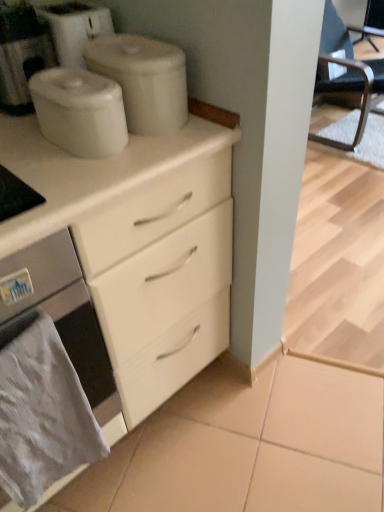
Question: In the image, is black leather chair at right on the left side or the right side of white matte coffee machine at upper left?

Choices:
 (A) left
 (B) right

Answer: (B)

Question: Is point (327, 30) closer or farther from the camera than point (16, 109)?

Choices:
 (A) farther
 (B) closer

Answer: (A)

Question: Which object is the closest to the satin white oven at lower left?

Choices:
 (A) gray fabric towel at lower left
 (B) white matte coffee machine at upper left
 (C) black leather chair at right
 (D) white matte containers at upper center, the second appliance when ordered from front to back
 (E) white glossy container at upper center, acting as the 2th appliance starting from the back

Answer: (A)

Question: Estimate the real-world distances between objects in this image. Which object is closer to the white glossy container at upper center, acting as the 2th appliance starting from the back?

Choices:
 (A) satin white oven at lower left
 (B) black leather chair at right
 (C) gray fabric towel at lower left
 (D) white matte coffee machine at upper left
 (E) white matte containers at upper center, the second appliance when ordered from front to back

Answer: (E)